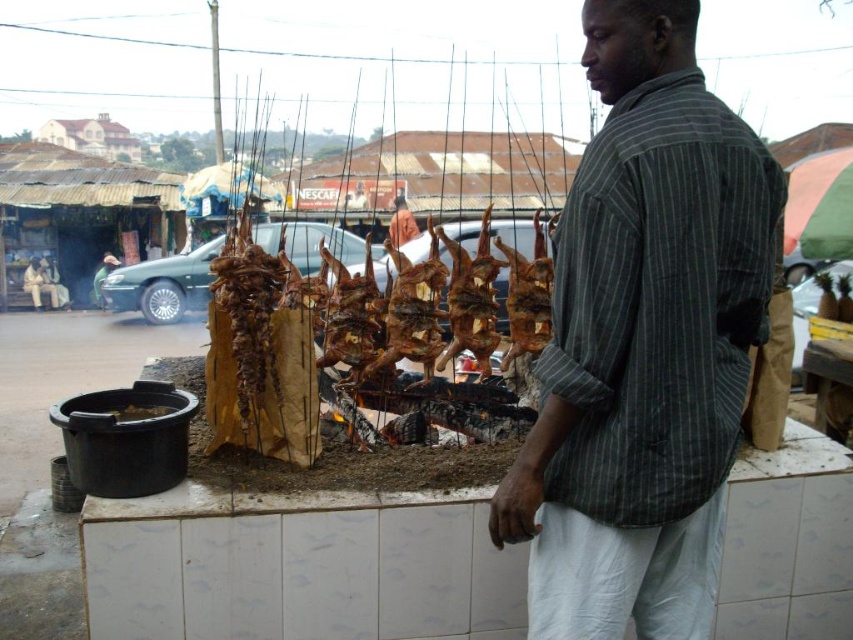
Question: Can you confirm if brown crispy chicken at center is positioned to the left of brown matte pot at lower left?

Choices:
 (A) yes
 (B) no

Answer: (B)

Question: Based on their relative distances, which object is farther from the matte brown shirt at center?

Choices:
 (A) brown matte pot at lower left
 (B) striped cotton shirt at center
 (C) brown crispy chicken at center

Answer: (B)

Question: Which of these objects is positioned closest to the brown crispy chicken at center?

Choices:
 (A) brown matte pot at lower left
 (B) matte brown shirt at center
 (C) striped cotton shirt at center

Answer: (A)

Question: Can you confirm if brown crispy chicken at center is thinner than matte brown shirt at center?

Choices:
 (A) yes
 (B) no

Answer: (B)

Question: Estimate the real-world distances between objects in this image. Which object is closer to the matte brown shirt at center?

Choices:
 (A) brown matte pot at lower left
 (B) brown crispy chicken at center
 (C) striped cotton shirt at center

Answer: (B)

Question: Where is brown crispy chicken at center located in relation to matte brown shirt at center in the image?

Choices:
 (A) right
 (B) left

Answer: (A)